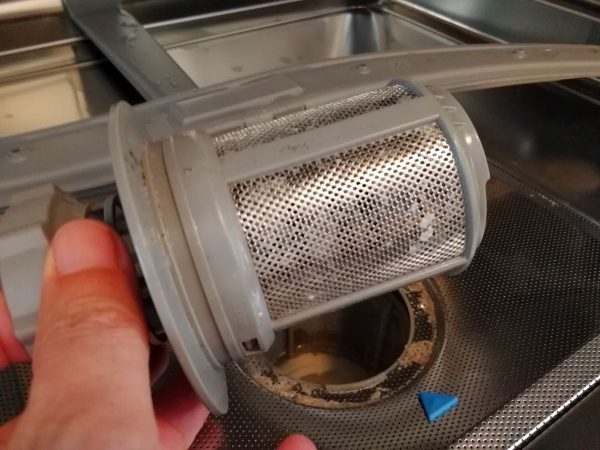
Find the location of a particular element. sink strainer flange is located at coordinates (142, 251).